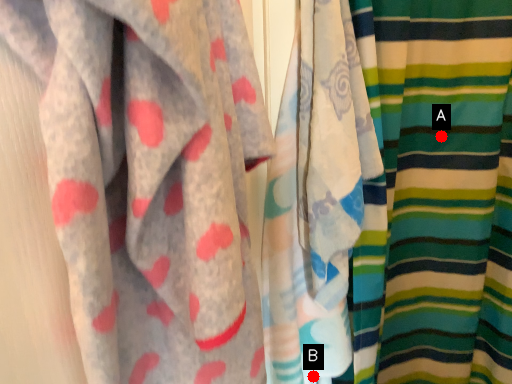
Question: Two points are circled on the image, labeled by A and B beside each circle. Which point appears farthest from the camera in this image?

Choices:
 (A) A is further
 (B) B is further

Answer: (A)